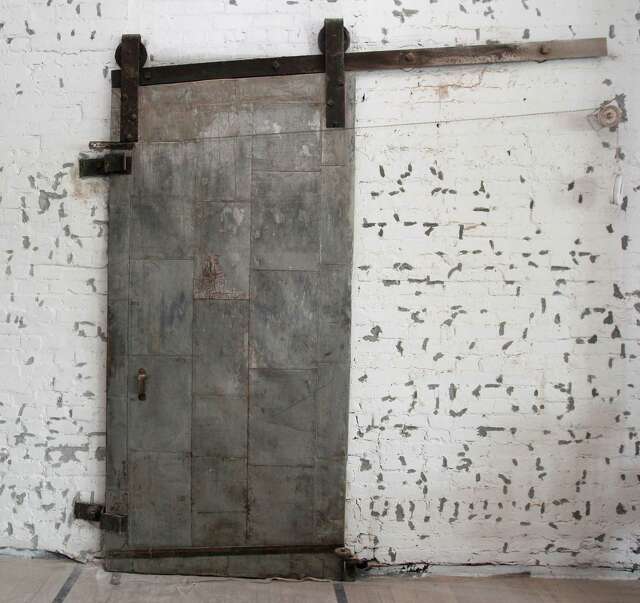
Where is `chips in paint`? This screenshot has height=603, width=640. chips in paint is located at coordinates (483, 429), (451, 390), (476, 390), (492, 385), (507, 348), (500, 329), (624, 242), (481, 207).